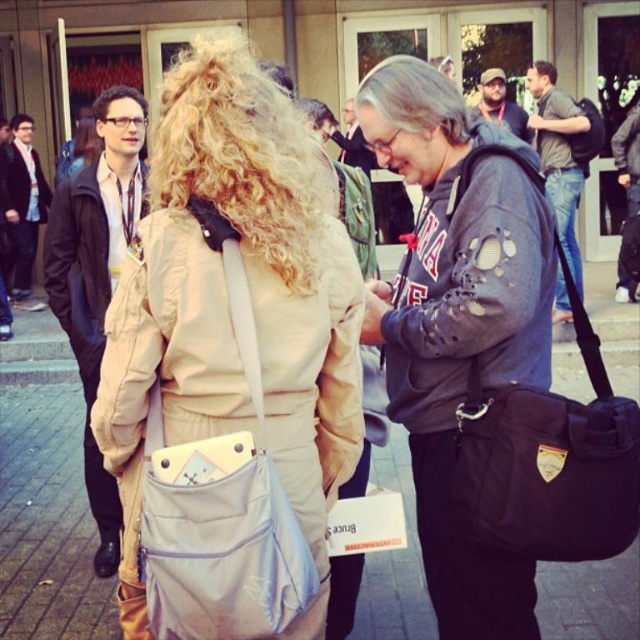
You are a fashion designer observing the beige fabric coat at upper center and the beige fabric jacket at center. Which one would you recommend for a client who wants a more voluminous and roomy outfit?

The beige fabric coat at upper center is larger in size, so it would be the better choice for a more voluminous and roomy outfit.

You are standing at the entrance of the building and want to take a photo of the beige fabric coat at upper center. If your camera has a maximum focus range of 6 feet, will you be able to capture it clearly?

The beige fabric coat at upper center is 5.94 feet away from the camera, which is within the 6 feet maximum focus range. Therefore, you can capture it clearly.

You are at an event and need to hand a document to the person in the beige fabric coat at upper center. You are currently standing near the beige fabric jacket at center. Which direction should you move to reach the coat?

The beige fabric coat at upper center is to the left of the beige fabric jacket at center. Therefore, you should move to your left to reach the coat.